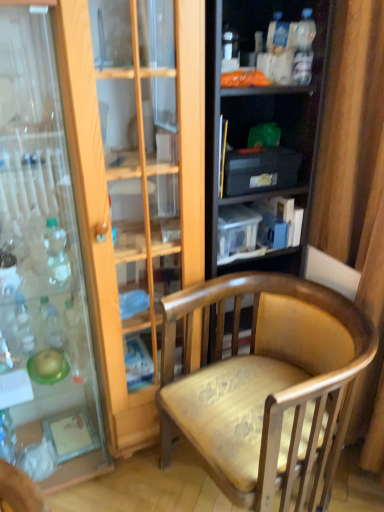
The image size is (384, 512). Describe the element at coordinates (23, 325) in the screenshot. I see `translucent plastic bottle at left, placed as the 2th bottle when sorted from right to left` at that location.

Describe the element at coordinates (265, 385) in the screenshot. I see `wooden armchair at center` at that location.

The width and height of the screenshot is (384, 512). Find the location of `wooden armchair at center`. wooden armchair at center is located at coordinates (265, 385).

Identify the location of translucent plastic bottles at upper right, acting as the first shelf starting from the top. This screenshot has width=384, height=512. (287, 37).

Find the location of `black plastic storage at upper center, the 2th shelf from the top`. black plastic storage at upper center, the 2th shelf from the top is located at coordinates (269, 138).

At what (x,y) coordinates should I click in order to perform the action: click on clear glass bottle at left, acting as the 1th bottle starting from the front. Please return your answer as a coordinate pair (x, y). This screenshot has height=512, width=384. Looking at the image, I should click on (56, 254).

Are wooden armchair at center and translucent plastic bottles at upper right, arranged as the 2th shelf when ordered from the bottom, far apart?

wooden armchair at center is near translucent plastic bottles at upper right, arranged as the 2th shelf when ordered from the bottom, not far away.

Does wooden armchair at center appear on the right side of translucent plastic bottles at upper right, arranged as the 2th shelf when ordered from the bottom?

Incorrect, wooden armchair at center is not on the right side of translucent plastic bottles at upper right, arranged as the 2th shelf when ordered from the bottom.

Based on the photo, what's the angular difference between wooden armchair at center and translucent plastic bottles at upper right, arranged as the 2th shelf when ordered from the bottom,'s facing directions?

The angular difference between wooden armchair at center and translucent plastic bottles at upper right, arranged as the 2th shelf when ordered from the bottom, is 79.5 degrees.

Between translucent plastic bottle at left, the second bottle in the front-to-back sequence, and clear glass bottle at left, the 1th bottle viewed from the top, which one has more height?

Standing taller between the two is translucent plastic bottle at left, the second bottle in the front-to-back sequence.

Considering the relative sizes of translucent plastic bottle at left, the 2th bottle positioned from the top, and clear glass bottle at left, the 2th bottle from the left, in the image provided, is translucent plastic bottle at left, the 2th bottle positioned from the top, smaller than clear glass bottle at left, the 2th bottle from the left,?

No, translucent plastic bottle at left, the 2th bottle positioned from the top, is not smaller than clear glass bottle at left, the 2th bottle from the left.

Could you tell me if translucent plastic bottle at left, the second bottle in the front-to-back sequence, is facing clear glass bottle at left, the 2th bottle from the bottom?

No.

Is translucent plastic bottle at left, the 2th bottle positioned from the top, far from clear glass bottle at left, the second bottle viewed from the back?

No, translucent plastic bottle at left, the 2th bottle positioned from the top, is not far away from clear glass bottle at left, the second bottle viewed from the back.

Is translucent plastic bottle at left, the 1th bottle positioned from the left, in front of wooden armchair at center?

That is False.

Is translucent plastic bottle at left, placed as the 2th bottle when sorted from right to left, far away from wooden armchair at center?

No, there isn't a large distance between translucent plastic bottle at left, placed as the 2th bottle when sorted from right to left, and wooden armchair at center.

What's the angular difference between translucent plastic bottle at left, the 1th bottle positioned from the left, and wooden armchair at center's facing directions?

79 degrees separate the facing orientations of translucent plastic bottle at left, the 1th bottle positioned from the left, and wooden armchair at center.

From the image's perspective, which bottle is the 1st one above the wooden armchair at center? Please provide its 2D coordinates.

[(23, 325)]

Is wooden armchair at center oriented away from translucent plastic bottle at left, which appears as the first bottle when ordered from the bottom?

That's not correct — wooden armchair at center is not looking away from translucent plastic bottle at left, which appears as the first bottle when ordered from the bottom.

Choose the correct answer: Is wooden armchair at center inside translucent plastic bottle at left, which appears as the first bottle when ordered from the bottom, or outside it?

wooden armchair at center cannot be found inside translucent plastic bottle at left, which appears as the first bottle when ordered from the bottom.

Consider the image. From the image's perspective, which one is positioned lower, wooden armchair at center or translucent plastic bottle at left, the second bottle in the front-to-back sequence?

wooden armchair at center appears lower in the image.

From a real-world perspective, which object stands above the other?

translucent plastic bottle at left, the 2th bottle positioned from the top.

I want to click on shelf in front of the black plastic storage at upper center, which ranks as the first shelf in bottom-to-top order, so click(287, 37).

Is black plastic storage at upper center, the 2th shelf from the top, facing towards translucent plastic bottles at upper right, acting as the first shelf starting from the top?

No, black plastic storage at upper center, the 2th shelf from the top, is not facing towards translucent plastic bottles at upper right, acting as the first shelf starting from the top.

Is black plastic storage at upper center, the 2th shelf from the top, next to translucent plastic bottles at upper right, arranged as the 2th shelf when ordered from the bottom?

black plastic storage at upper center, the 2th shelf from the top, and translucent plastic bottles at upper right, arranged as the 2th shelf when ordered from the bottom, are clearly separated.

Which is correct: black plastic storage at upper center, the 2th shelf from the top, is inside translucent plastic bottles at upper right, acting as the first shelf starting from the top, or outside of it?

The correct answer is: outside.

Does black plastic storage at upper center, the 2th shelf from the top, have a lesser height compared to wooden armchair at center?

Yes.

How many degrees apart are the facing directions of black plastic storage at upper center, which ranks as the first shelf in bottom-to-top order, and wooden armchair at center?

The facing directions of black plastic storage at upper center, which ranks as the first shelf in bottom-to-top order, and wooden armchair at center are 79.7 degrees apart.

From a real-world perspective, is black plastic storage at upper center, which ranks as the first shelf in bottom-to-top order, positioned under wooden armchair at center based on gravity?

No, from a real-world perspective, black plastic storage at upper center, which ranks as the first shelf in bottom-to-top order, is not beneath wooden armchair at center.

From the image's perspective, is black plastic storage at upper center, the 2th shelf from the top, on top of wooden armchair at center?

Yes.

Consider the image. Is translucent plastic bottles at upper right, acting as the first shelf starting from the top, positioned with its back to wooden armchair at center?

No, translucent plastic bottles at upper right, acting as the first shelf starting from the top, is not facing the opposite direction of wooden armchair at center.

From a real-world perspective, between translucent plastic bottles at upper right, arranged as the 2th shelf when ordered from the bottom, and wooden armchair at center, who is vertically higher?

translucent plastic bottles at upper right, arranged as the 2th shelf when ordered from the bottom, is physically above.

Is translucent plastic bottles at upper right, acting as the first shelf starting from the top, far away from wooden armchair at center?

Actually, translucent plastic bottles at upper right, acting as the first shelf starting from the top, and wooden armchair at center are a little close together.

Visually, is translucent plastic bottles at upper right, acting as the first shelf starting from the top, positioned to the left or to the right of wooden armchair at center?

translucent plastic bottles at upper right, acting as the first shelf starting from the top, is positioned on wooden armchair at center's right side.

Identify the location of chair located below the translucent plastic bottles at upper right, arranged as the 2th shelf when ordered from the bottom (from the image's perspective). (265, 385).

You are a GUI agent. You are given a task and a screenshot of the screen. Output one action in this format:
    pyautogui.click(x=<x>, y=<y>)
    Task: Click on the bottle on the right of translucent plastic bottle at left, which appears as the 1th bottle when viewed from the back
    The height and width of the screenshot is (512, 384).
    Given the screenshot: What is the action you would take?
    pyautogui.click(x=56, y=254)

Considering their positions, is black plastic storage at upper center, which ranks as the first shelf in bottom-to-top order, positioned further to clear glass bottle at left, which is the 1th bottle from right to left, than translucent plastic bottle at left, which appears as the 1th bottle when viewed from the back?

black plastic storage at upper center, which ranks as the first shelf in bottom-to-top order, is positioned further to the anchor clear glass bottle at left, which is the 1th bottle from right to left.

Which object lies further to the anchor point black plastic storage at upper center, the 2th shelf from the top, translucent plastic bottles at upper right, acting as the first shelf starting from the top, or translucent plastic bottle at left, which appears as the 1th bottle when viewed from the back?

The object further to black plastic storage at upper center, the 2th shelf from the top, is translucent plastic bottle at left, which appears as the 1th bottle when viewed from the back.

Based on their spatial positions, is translucent plastic bottle at left, the second bottle in the front-to-back sequence, or wooden armchair at center closer to black plastic storage at upper center, which ranks as the first shelf in bottom-to-top order?

Among the two, wooden armchair at center is located nearer to black plastic storage at upper center, which ranks as the first shelf in bottom-to-top order.

Which object lies nearer to the anchor point wooden armchair at center, clear glass bottle at left, the 2th bottle from the bottom, or translucent plastic bottles at upper right, arranged as the 2th shelf when ordered from the bottom?

Among the two, clear glass bottle at left, the 2th bottle from the bottom, is located nearer to wooden armchair at center.

When comparing their distances from translucent plastic bottles at upper right, acting as the first shelf starting from the top, does black plastic storage at upper center, the 2th shelf from the top, or clear glass bottle at left, the 2th bottle from the bottom, seem further?

Among the two, clear glass bottle at left, the 2th bottle from the bottom, is located further to translucent plastic bottles at upper right, acting as the first shelf starting from the top.

Estimate the real-world distances between objects in this image. Which object is further from translucent plastic bottle at left, placed as the 2th bottle when sorted from right to left, translucent plastic bottles at upper right, acting as the first shelf starting from the top, or black plastic storage at upper center, the 2th shelf from the top?

The object further to translucent plastic bottle at left, placed as the 2th bottle when sorted from right to left, is translucent plastic bottles at upper right, acting as the first shelf starting from the top.

From the image, which object appears to be farther from translucent plastic bottles at upper right, acting as the first shelf starting from the top, wooden armchair at center or translucent plastic bottle at left, placed as the 2th bottle when sorted from right to left?

The object further to translucent plastic bottles at upper right, acting as the first shelf starting from the top, is translucent plastic bottle at left, placed as the 2th bottle when sorted from right to left.

From the image, which object appears to be nearer to translucent plastic bottle at left, which appears as the 1th bottle when viewed from the back, translucent plastic bottles at upper right, acting as the first shelf starting from the top, or wooden armchair at center?

wooden armchair at center lies closer to translucent plastic bottle at left, which appears as the 1th bottle when viewed from the back, than the other object.

I want to click on chair between translucent plastic bottle at left, the second bottle in the front-to-back sequence, and black plastic storage at upper center, the 2th shelf from the top, from left to right, so click(x=265, y=385).

This screenshot has height=512, width=384. Identify the location of shelf between translucent plastic bottle at left, the second bottle in the front-to-back sequence, and translucent plastic bottles at upper right, arranged as the 2th shelf when ordered from the bottom. (269, 138).

Locate an element on the screen. This screenshot has width=384, height=512. bottle between translucent plastic bottles at upper right, acting as the first shelf starting from the top, and translucent plastic bottle at left, which appears as the first bottle when ordered from the bottom, vertically is located at coordinates (56, 254).

This screenshot has width=384, height=512. Find the location of `shelf situated between clear glass bottle at left, the 2th bottle from the bottom, and translucent plastic bottles at upper right, arranged as the 2th shelf when ordered from the bottom, from left to right`. shelf situated between clear glass bottle at left, the 2th bottle from the bottom, and translucent plastic bottles at upper right, arranged as the 2th shelf when ordered from the bottom, from left to right is located at coordinates (269, 138).